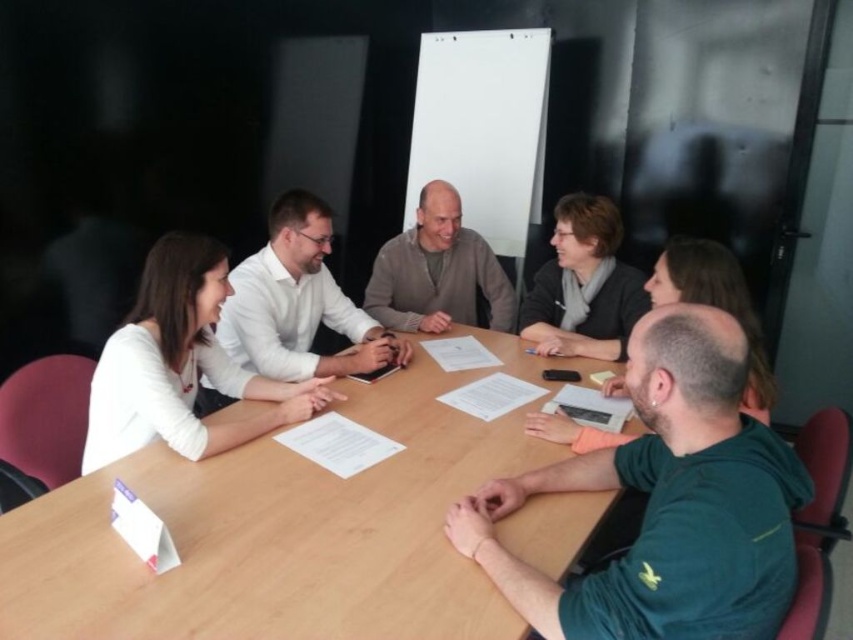
Between point (454, 385) and point (700, 413), which one is positioned behind?

Positioned behind is point (454, 385).

Measure the distance between wooden table at center and camera.

wooden table at center and camera are 1.10 meters apart.

I want to click on wooden table at center, so 286,531.

Does gray knit sweater at center appear on the right side of dark gray sweater at upper right?

No, gray knit sweater at center is not to the right of dark gray sweater at upper right.

Is point (439, 289) in front of point (735, 301)?

No, it is behind (735, 301).

Find the location of `gray knit sweater at center`. gray knit sweater at center is located at coordinates (437, 272).

Based on the photo, can you confirm if wooden table at center is positioned above white shirt at upper left?

No.

In the scene shown: Does wooden table at center appear under white shirt at upper left?

A: Indeed, wooden table at center is positioned under white shirt at upper left.

You are a GUI agent. You are given a task and a screenshot of the screen. Output one action in this format:
    pyautogui.click(x=<x>, y=<y>)
    Task: Click on the wooden table at center
    The image size is (853, 640).
    Given the screenshot: What is the action you would take?
    pyautogui.click(x=286, y=531)

Identify the location of wooden table at center. The width and height of the screenshot is (853, 640). (286, 531).